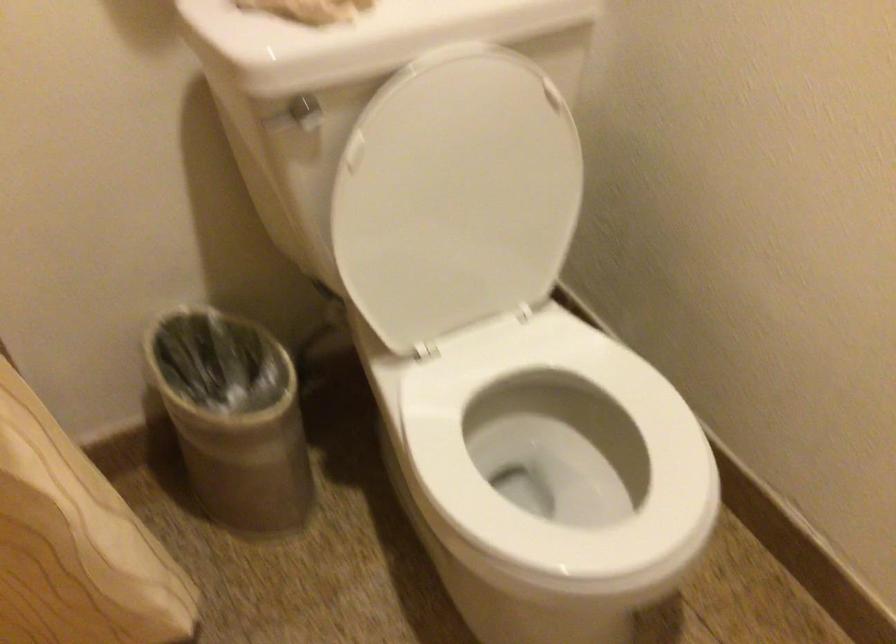
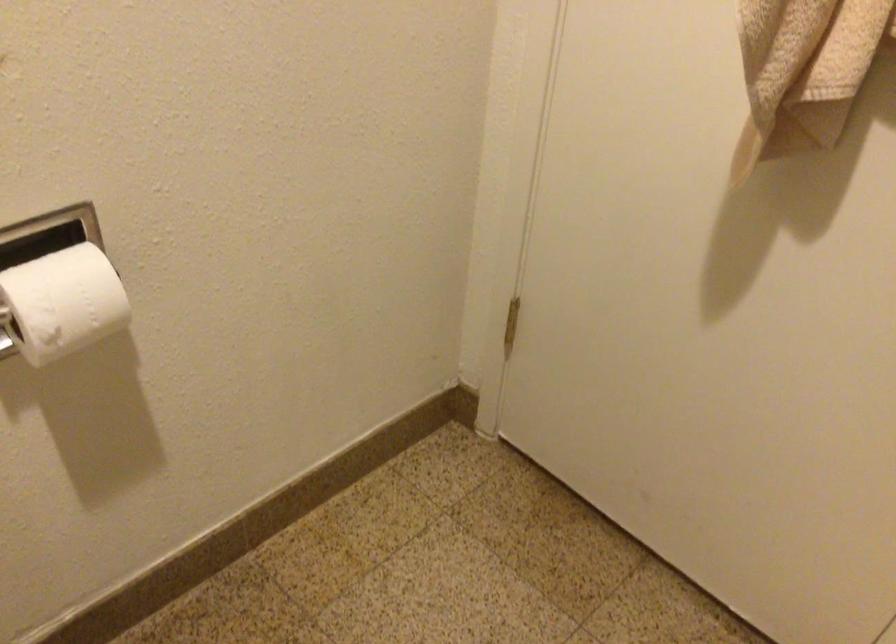
The first image is from the beginning of the video and the second image is from the end. How did the camera likely rotate when shooting the video?

The camera's rotation is toward right-down.